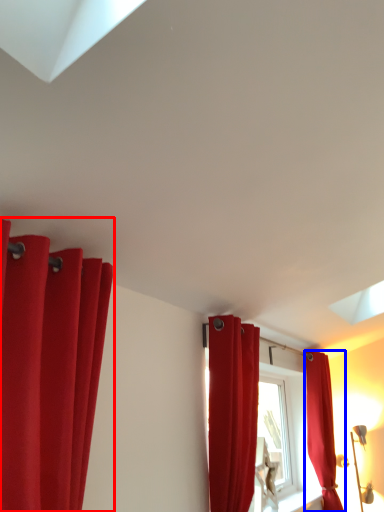
Question: Among these objects, which one is farthest to the camera, curtain (highlighted by a red box) or curtain (highlighted by a blue box)?

Choices:
 (A) curtain
 (B) curtain

Answer: (B)